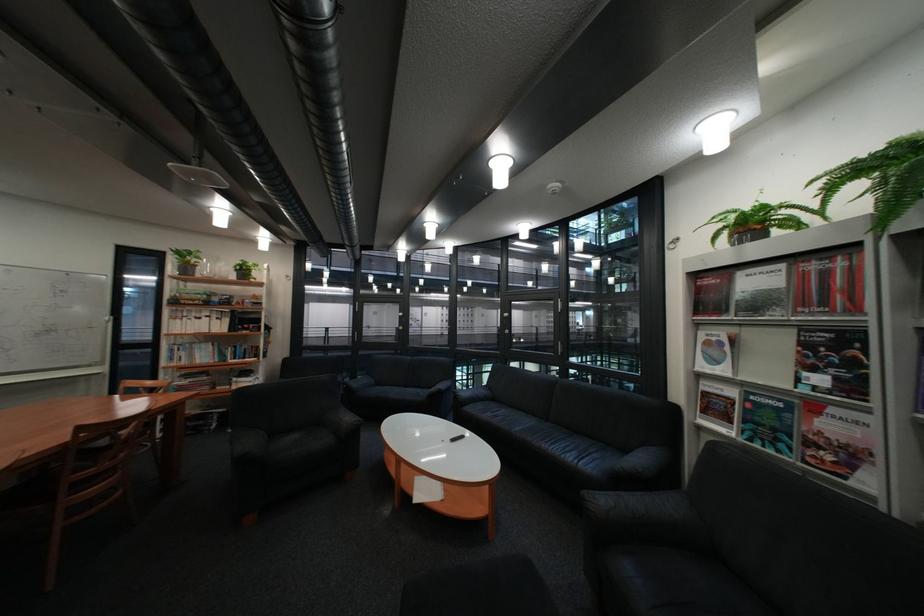
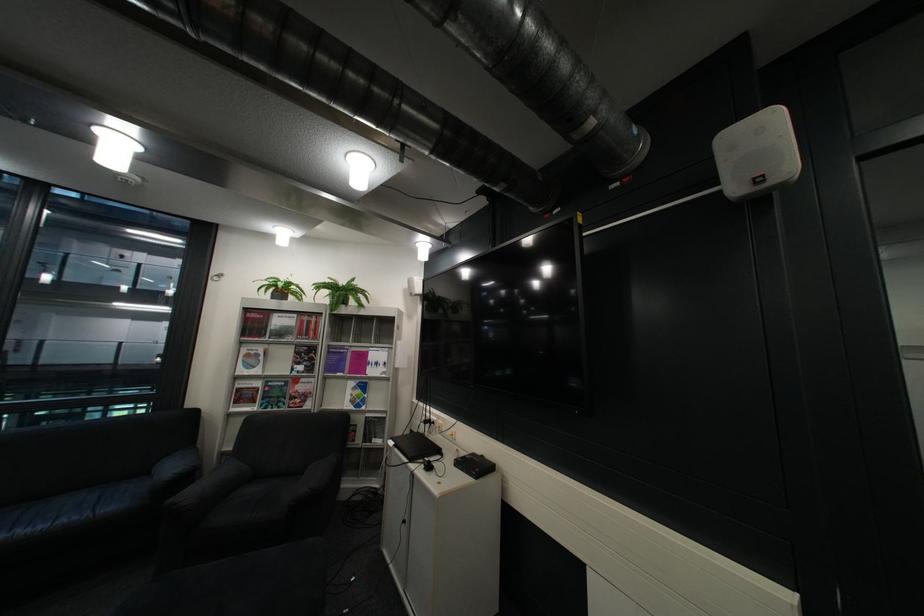
Find the pixel in the second image that matches point (783, 421) in the first image.

(290, 394)